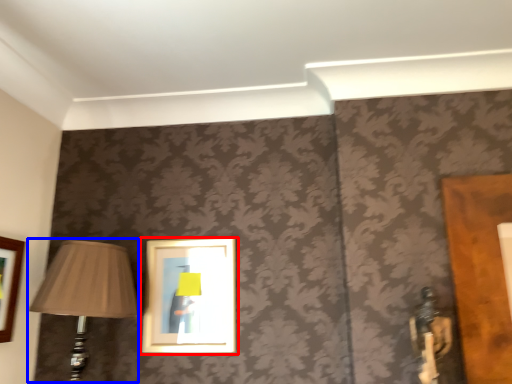
Question: Which of the following is the closest to the observer, picture frame (highlighted by a red box) or lamp (highlighted by a blue box)?

Choices:
 (A) picture frame
 (B) lamp

Answer: (B)